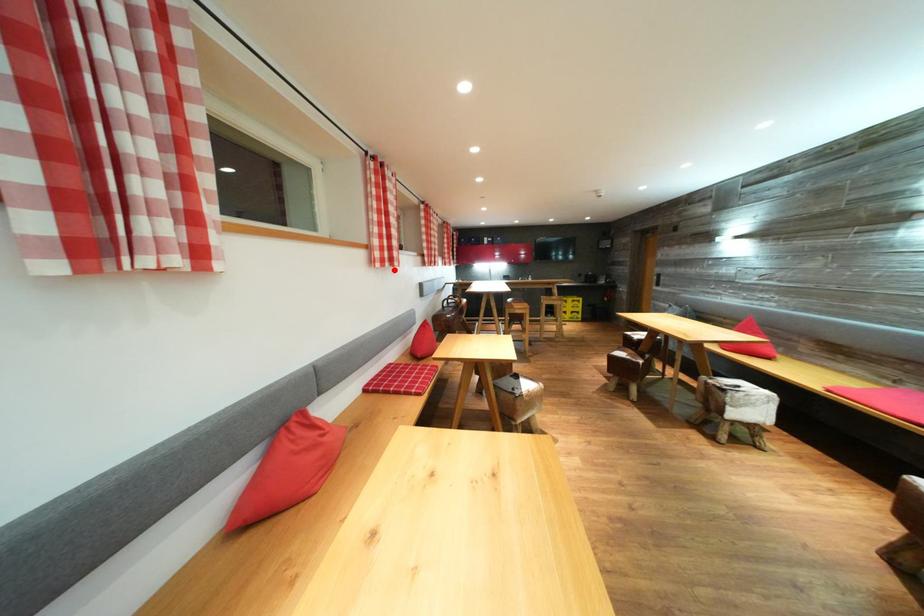
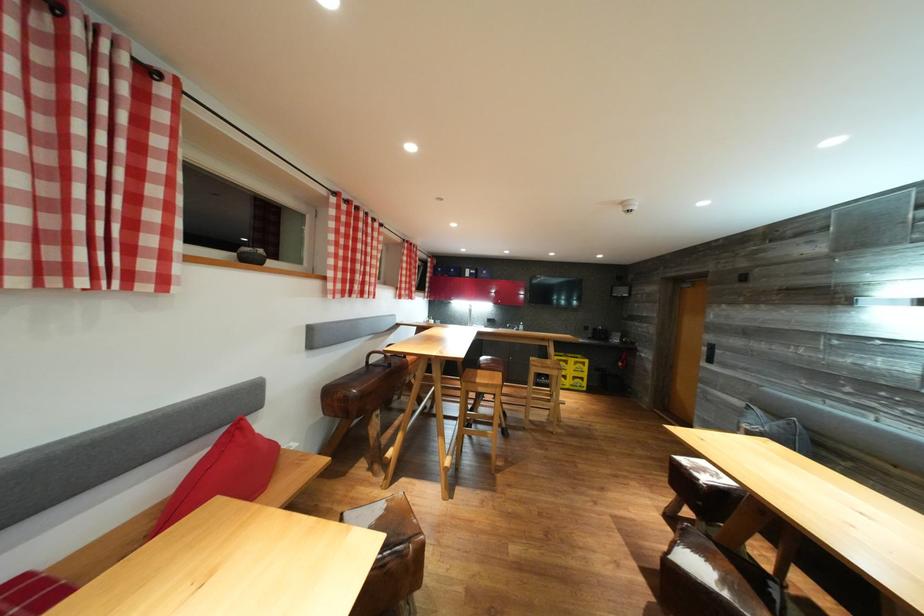
Where in the second image is the point corresponding to the highlighted location from the first image?

(23, 286)